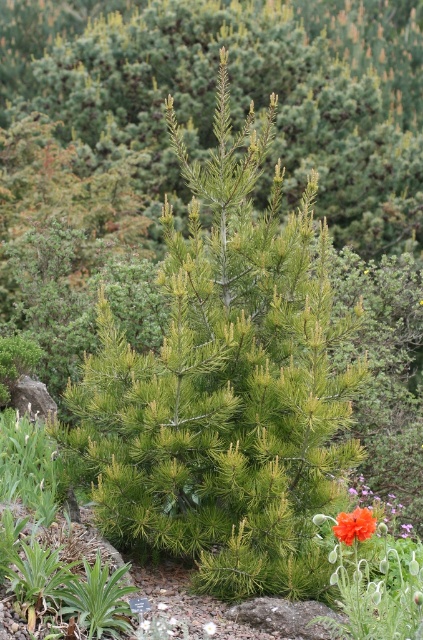
You are standing at the point marked as point (225, 385) in the image. What object is directly in front of you?

The point (225, 385) corresponds to the green needle like tree at center, so the object directly in front of you is the green needle like tree at center.